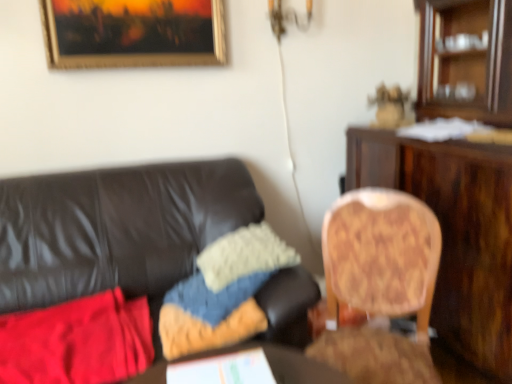
What do you see at coordinates (381, 255) in the screenshot? I see `wooden chair at right, which is the first chair in right-to-left order` at bounding box center [381, 255].

The height and width of the screenshot is (384, 512). In order to click on red fabric at left in this screenshot , I will do `click(78, 341)`.

The width and height of the screenshot is (512, 384). What are the coordinates of `knitted fabric pillow at center, which is the 1th pillow from bottom to top` in the screenshot? It's located at (210, 315).

In order to click on wooden cabinet at upper right in this screenshot , I will do `click(468, 60)`.

What is the approximate width of wooden round table at center?

wooden round table at center is 7.02 inches in width.

Where is `white fuzzy pillow at center, arranged as the 1th pillow when viewed from the top`? The width and height of the screenshot is (512, 384). white fuzzy pillow at center, arranged as the 1th pillow when viewed from the top is located at coordinates (244, 255).

Locate an element on the screen. The height and width of the screenshot is (384, 512). desk behind the wooden round table at center is located at coordinates (455, 232).

Considering the sizes of wooden desk at right and wooden round table at center in the image, is wooden desk at right bigger or smaller than wooden round table at center?

In the image, wooden desk at right appears to be larger than wooden round table at center.

Is wooden round table at center surrounded by wooden desk at right?

Definitely not — wooden round table at center is not inside wooden desk at right.

Which object is closer to the camera taking this photo, wooden desk at right or wooden round table at center?

Positioned in front is wooden round table at center.

Which of these two, wooden chair at right, which appears as the 2th chair when viewed from the left, or wooden cabinet at upper right, stands taller?

wooden chair at right, which appears as the 2th chair when viewed from the left, is taller.

Is wooden chair at right, which appears as the 2th chair when viewed from the left, looking in the opposite direction of wooden cabinet at upper right?

wooden chair at right, which appears as the 2th chair when viewed from the left, is not turned away from wooden cabinet at upper right.

Does wooden chair at right, which appears as the 2th chair when viewed from the left, appear on the left side of wooden cabinet at upper right?

Yes, wooden chair at right, which appears as the 2th chair when viewed from the left, is to the left of wooden cabinet at upper right.

Relative to wooden cabinet at upper right, is wooden chair at right, which appears as the 2th chair when viewed from the left, in front or behind?

Visually, wooden chair at right, which appears as the 2th chair when viewed from the left, is located in front of wooden cabinet at upper right.

Find the location of a particular element. material in front of the wooden desk at right is located at coordinates (78, 341).

Is red fabric at left positioned with its back to wooden desk at right?

red fabric at left is not turned away from wooden desk at right.

Is red fabric at left positioned in front of wooden desk at right?

Yes.

Considering the sizes of objects red fabric at left and wooden desk at right in the image provided, who is bigger, red fabric at left or wooden desk at right?

wooden desk at right is bigger.

Based on the photo, considering the relative sizes of wooden round table at center and wooden desk at right in the image provided, is wooden round table at center taller than wooden desk at right?

No, wooden round table at center is not taller than wooden desk at right.

From the image's perspective, would you say wooden round table at center is positioned over wooden desk at right?

No.

Is wooden round table at center completely or partially outside of wooden desk at right?

wooden round table at center is positioned outside wooden desk at right.

Locate an element on the screen. chair that is on the left side of knitted fabric pillow at center, which is the 1th pillow from bottom to top is located at coordinates (116, 230).

Between knitted fabric pillow at center, which is the 1th pillow from bottom to top, and wooden chair at right, arranged as the second chair when viewed from the right, which one has less height?

Standing shorter between the two is knitted fabric pillow at center, which is the 1th pillow from bottom to top.

Is knitted fabric pillow at center, which is the 1th pillow from bottom to top, to the right of wooden chair at right, the 1th chair in the left-to-right sequence, from the viewer's perspective?

Yes, knitted fabric pillow at center, which is the 1th pillow from bottom to top, is to the right of wooden chair at right, the 1th chair in the left-to-right sequence.

Do you think wooden chair at right, the 1th chair in the left-to-right sequence, is within gold-framed painting at upper center, or outside of it?

wooden chair at right, the 1th chair in the left-to-right sequence, is spatially situated outside gold-framed painting at upper center.

Where is `chair that is the 1st object located below the gold-framed painting at upper center (from the image's perspective)`? chair that is the 1st object located below the gold-framed painting at upper center (from the image's perspective) is located at coordinates (116, 230).

Looking at this image, between wooden chair at right, arranged as the second chair when viewed from the right, and gold-framed painting at upper center, which one appears on the left side from the viewer's perspective?

From the viewer's perspective, gold-framed painting at upper center appears more on the left side.

Which of these two, wooden chair at right, the 1th chair in the left-to-right sequence, or gold-framed painting at upper center, stands shorter?

gold-framed painting at upper center is shorter.

Which is closer to the camera, (426, 249) or (105, 13)?

Point (426, 249) appears to be closer to the viewer than point (105, 13).

Which object is positioned more to the left, wooden chair at right, which appears as the 2th chair when viewed from the left, or gold-framed painting at upper center?

From the viewer's perspective, gold-framed painting at upper center appears more on the left side.

Is wooden chair at right, which appears as the 2th chair when viewed from the left, looking in the opposite direction of gold-framed painting at upper center?

wooden chair at right, which appears as the 2th chair when viewed from the left, is not turned away from gold-framed painting at upper center.

From the image's perspective, between wooden chair at right, which is the first chair in right-to-left order, and gold-framed painting at upper center, which one is located above?

gold-framed painting at upper center.

Locate an element on the screen. Image resolution: width=512 pixels, height=384 pixels. round table above the wooden desk at right (from a real-world perspective) is located at coordinates (284, 364).

Locate an element on the screen. This screenshot has height=384, width=512. chair that is the 2nd one when counting downward from the wooden cabinet at upper right (from the image's perspective) is located at coordinates [381, 255].

When comparing their distances from wooden chair at right, which is the first chair in right-to-left order, does wooden chair at right, arranged as the second chair when viewed from the right, or knitted fabric pillow at center, the 2th pillow positioned from the top, seem further?

wooden chair at right, arranged as the second chair when viewed from the right.

Which object lies nearer to the anchor point wooden desk at right, wooden chair at right, arranged as the second chair when viewed from the right, or white fuzzy pillow at center, the 2th pillow from the bottom?

Among the two, white fuzzy pillow at center, the 2th pillow from the bottom, is located nearer to wooden desk at right.

Estimate the real-world distances between objects in this image. Which object is closer to gold-framed painting at upper center, wooden chair at right, which appears as the 2th chair when viewed from the left, or wooden round table at center?

wooden chair at right, which appears as the 2th chair when viewed from the left, is closer to gold-framed painting at upper center.

Estimate the real-world distances between objects in this image. Which object is closer to wooden chair at right, arranged as the second chair when viewed from the right, red fabric at left or wooden cabinet at upper right?

red fabric at left.

When comparing their distances from gold-framed painting at upper center, does red fabric at left or wooden chair at right, arranged as the second chair when viewed from the right, seem further?

red fabric at left is positioned further to the anchor gold-framed painting at upper center.

When comparing their distances from white fuzzy pillow at center, arranged as the 1th pillow when viewed from the top, does knitted fabric pillow at center, the 2th pillow positioned from the top, or wooden chair at right, the 1th chair in the left-to-right sequence, seem further?

Based on the image, wooden chair at right, the 1th chair in the left-to-right sequence, appears to be further to white fuzzy pillow at center, arranged as the 1th pillow when viewed from the top.

Estimate the real-world distances between objects in this image. Which object is closer to wooden round table at center, wooden desk at right or white fuzzy pillow at center, the 2th pillow from the bottom?

white fuzzy pillow at center, the 2th pillow from the bottom.

Looking at the image, which one is located further to wooden chair at right, arranged as the second chair when viewed from the right, knitted fabric pillow at center, which is the 1th pillow from bottom to top, or red fabric at left?

Based on the image, knitted fabric pillow at center, which is the 1th pillow from bottom to top, appears to be further to wooden chair at right, arranged as the second chair when viewed from the right.

What are the coordinates of `desk between wooden cabinet at upper right and wooden chair at right, which appears as the 2th chair when viewed from the left, vertically` in the screenshot? It's located at (455, 232).

The image size is (512, 384). Find the location of `desk between red fabric at left and wooden cabinet at upper right`. desk between red fabric at left and wooden cabinet at upper right is located at coordinates (455, 232).

Where is `pillow between wooden round table at center and wooden desk at right`? pillow between wooden round table at center and wooden desk at right is located at coordinates 244,255.

In order to click on picture frame between red fabric at left and wooden desk at right in the horizontal direction in this screenshot , I will do `click(133, 33)`.